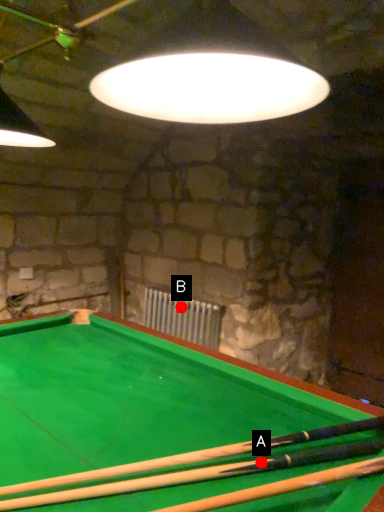
Question: Two points are circled on the image, labeled by A and B beside each circle. Which point appears farthest from the camera in this image?

Choices:
 (A) A is further
 (B) B is further

Answer: (B)